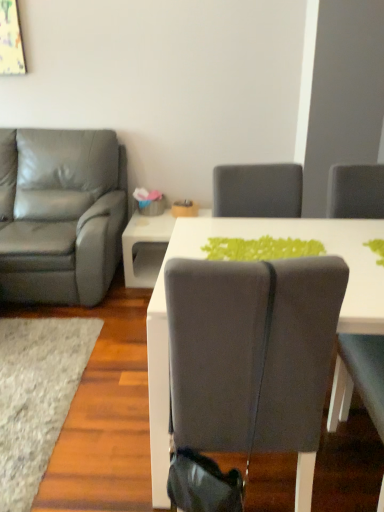
You are a GUI agent. You are given a task and a screenshot of the screen. Output one action in this format:
    pyautogui.click(x=<x>, y=<y>)
    Task: Click on the vacant space situated on the left part of matte gray chair at center, the first chair from the right
    The width and height of the screenshot is (384, 512).
    Given the screenshot: What is the action you would take?
    pyautogui.click(x=106, y=450)